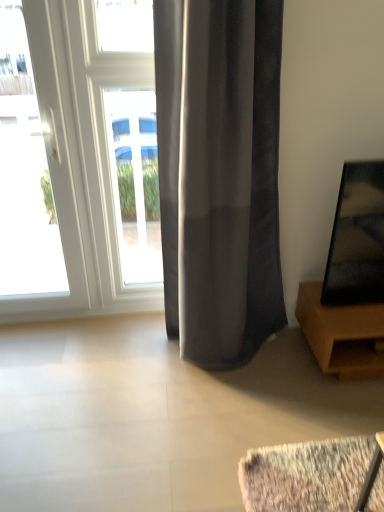
Question: Is white glossy window at center bigger or smaller than satin gray curtain at center?

Choices:
 (A) small
 (B) big

Answer: (A)

Question: Is point (137, 224) closer or farther from the camera than point (220, 261)?

Choices:
 (A) closer
 (B) farther

Answer: (B)

Question: Which object is positioned farthest from the brown wooden tv stand at right?

Choices:
 (A) satin gray curtain at center
 (B) white glossy window at center
 (C) white glossy door at left

Answer: (C)

Question: Which of these objects is positioned closest to the white glossy door at left?

Choices:
 (A) brown wooden tv stand at right
 (B) satin gray curtain at center
 (C) white glossy window at center

Answer: (C)